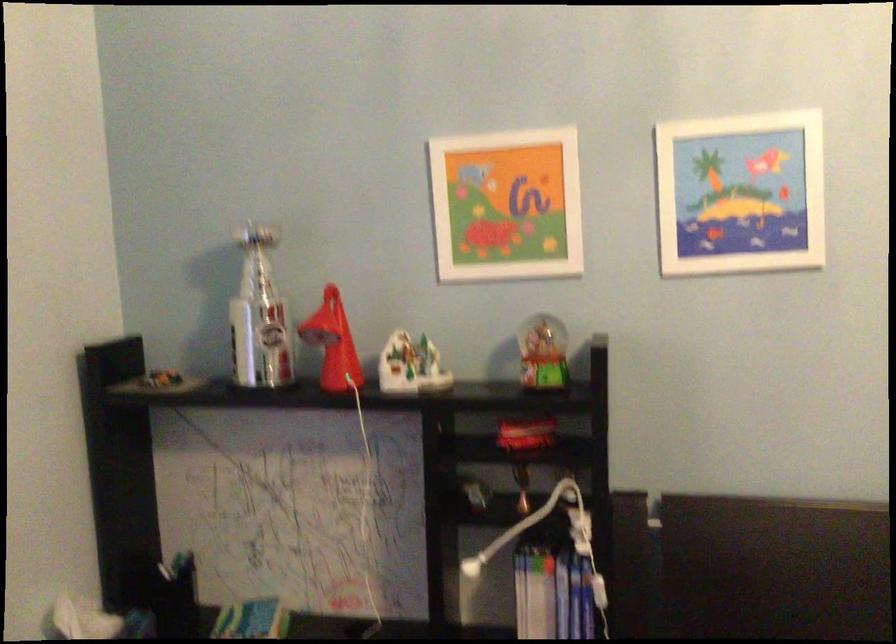
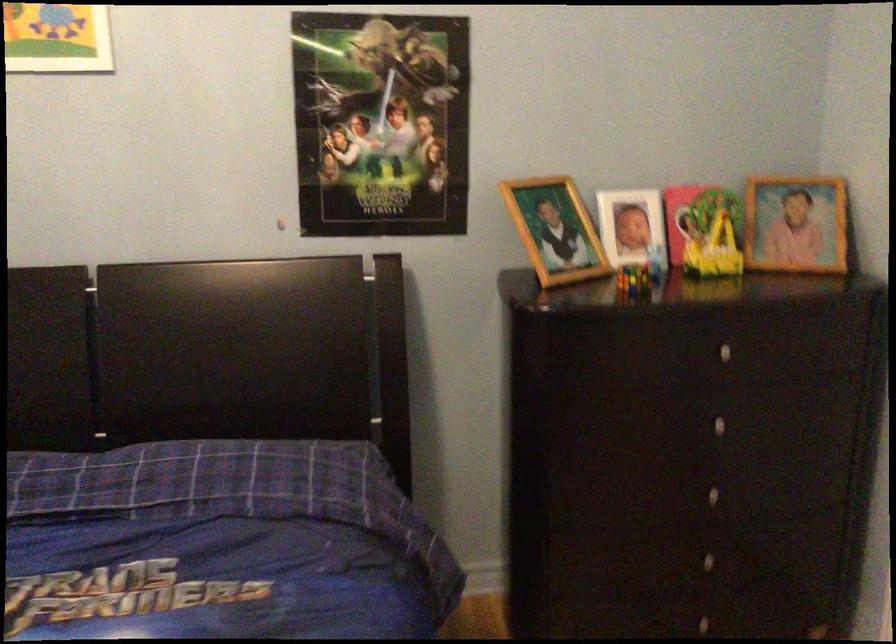
What movement of the cameraman would produce the second image?

The cameraman moved toward right, backward.